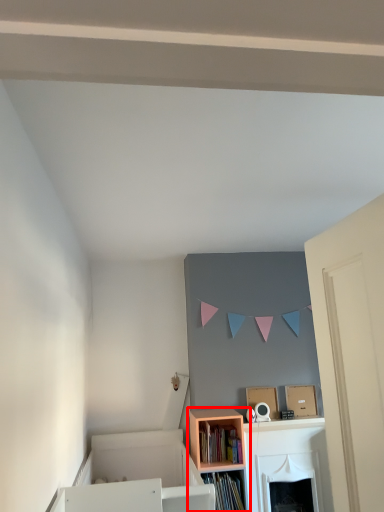
Question: From the image's perspective, what is the correct spatial relationship of shelf (annotated by the red box) in relation to book?

Choices:
 (A) above
 (B) below

Answer: (B)